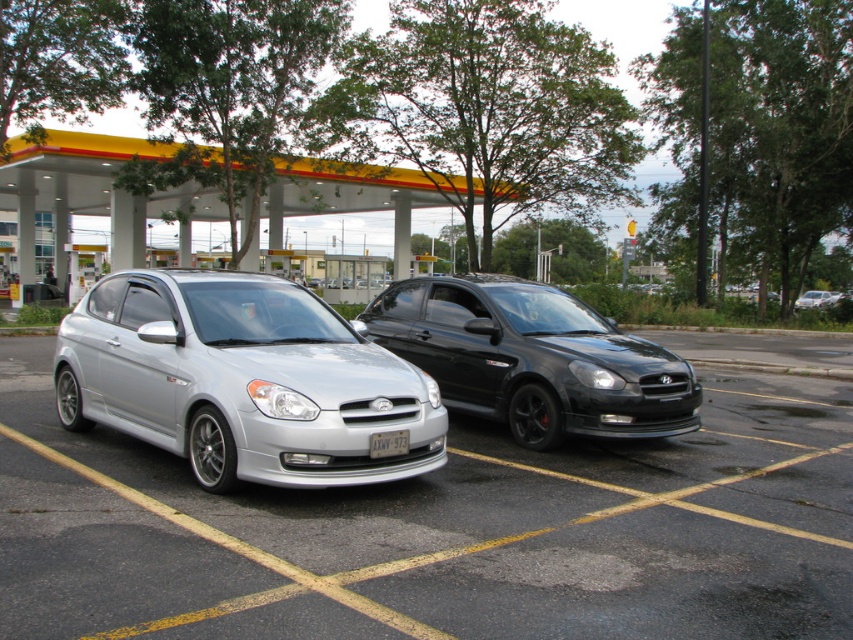
Question: Which of the following is the closest to the observer?

Choices:
 (A) (798, 301)
 (B) (390, 340)

Answer: (B)

Question: Can you confirm if white concrete gas station at upper center is wider than white plastic license plate at center?

Choices:
 (A) no
 (B) yes

Answer: (B)

Question: Does silver metallic car at center have a lesser width compared to white plastic license plate at center?

Choices:
 (A) yes
 (B) no

Answer: (B)

Question: Which object is positioned farthest from the white plastic license plate at center?

Choices:
 (A) silver metallic hatchback at center
 (B) glossy black sedan at center
 (C) white concrete gas station at upper center

Answer: (C)

Question: Estimate the real-world distances between objects in this image. Which object is closer to the glossy black sedan at center?

Choices:
 (A) white plastic license plate at center
 (B) metallic silver sedan at center
 (C) silver metallic hatchback at center

Answer: (C)

Question: In this image, where is glossy black sedan at center located relative to metallic silver sedan at center?

Choices:
 (A) above
 (B) below

Answer: (B)